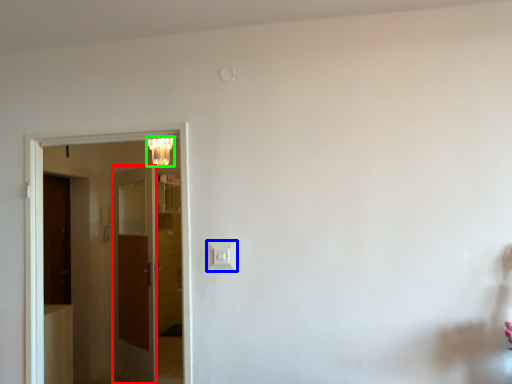
Question: Which is farther away from door (highlighted by a red box)? light switch (highlighted by a blue box) or lamp (highlighted by a green box)?

Choices:
 (A) light switch
 (B) lamp

Answer: (A)